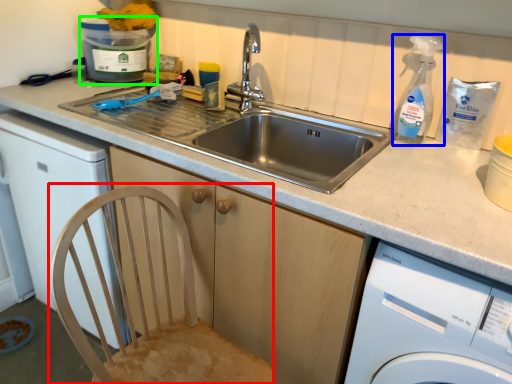
Question: Which is nearer to the feeding chair (highlighted by a red box)? cleaning product (highlighted by a blue box) or water cooler (highlighted by a green box).

Choices:
 (A) cleaning product
 (B) water cooler

Answer: (A)